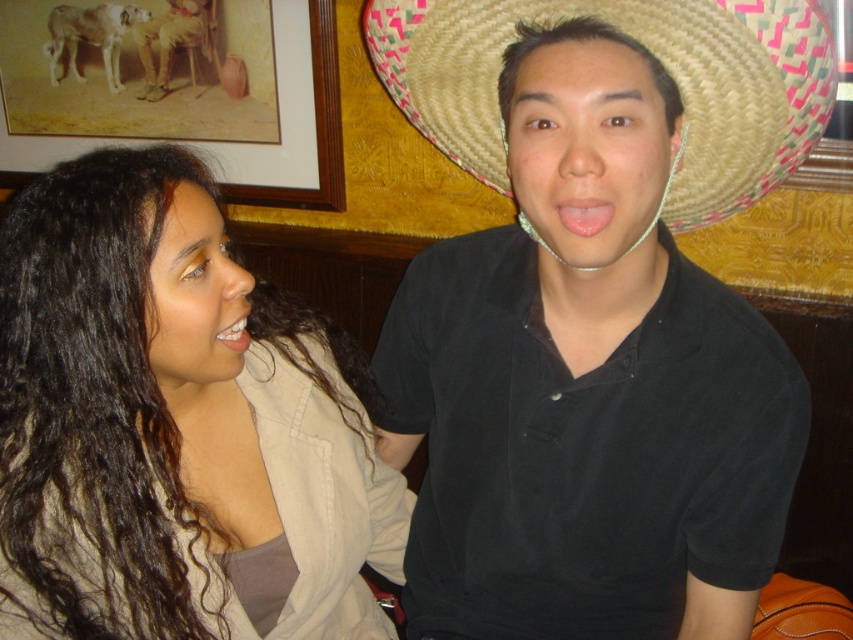
Question: Which is nearer to the wooden framed picture at upper left?

Choices:
 (A) white glossy teeth at lower left
 (B) pink matte lips at center
 (C) straw hat at upper center

Answer: (C)

Question: Does straw hat at upper center have a lesser width compared to brown leather boots at upper left?

Choices:
 (A) yes
 (B) no

Answer: (B)

Question: Can you confirm if straw hat at upper center is smaller than pink matte lips at center?

Choices:
 (A) yes
 (B) no

Answer: (B)

Question: Is wooden framed picture at upper left further to camera compared to white glossy teeth at lower left?

Choices:
 (A) yes
 (B) no

Answer: (A)

Question: Which point is closer to the camera?

Choices:
 (A) straw hat at upper center
 (B) black matte shirt at center
 (C) dark brown curly hair at left

Answer: (C)

Question: Which point is farther to the camera?

Choices:
 (A) black matte shirt at center
 (B) white glossy teeth at lower left
 (C) brown leather boots at upper left
 (D) pink matte lips at center

Answer: (C)